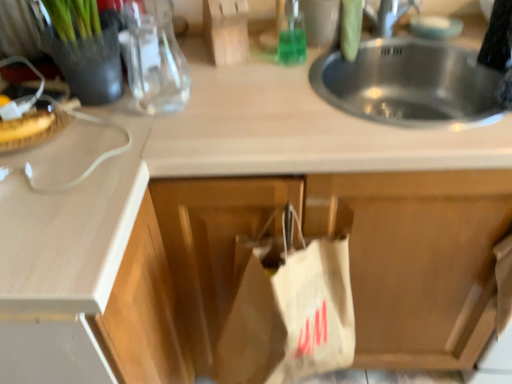
Question: Should I look upward or downward to see green glass bottle at upper center, which appears as the 2th bottle when viewed from the left?

Choices:
 (A) up
 (B) down

Answer: (A)

Question: From a real-world perspective, does white matte cabinet at center stand above green glass bottle at upper center, which is the 2th bottle from front to back?

Choices:
 (A) yes
 (B) no

Answer: (B)

Question: Is white matte cabinet at center positioned beyond the bounds of green glass bottle at upper center, the 1th bottle viewed from the right?

Choices:
 (A) yes
 (B) no

Answer: (A)

Question: From the image's perspective, is white matte cabinet at center over green glass bottle at upper center, the 1th bottle viewed from the right?

Choices:
 (A) no
 (B) yes

Answer: (A)

Question: Does white matte cabinet at center have a larger size compared to green glass bottle at upper center, which appears as the 2th bottle when viewed from the left?

Choices:
 (A) no
 (B) yes

Answer: (B)

Question: Does white matte cabinet at center have a lesser height compared to green glass bottle at upper center, which appears as the 1th bottle when viewed from the back?

Choices:
 (A) no
 (B) yes

Answer: (A)

Question: Considering the relative sizes of white matte cabinet at center and green glass bottle at upper center, which appears as the 1th bottle when viewed from the back, in the image provided, is white matte cabinet at center taller than green glass bottle at upper center, which appears as the 1th bottle when viewed from the back,?

Choices:
 (A) yes
 (B) no

Answer: (A)

Question: Is transparent glass bottle at upper left, which is the second bottle from back to front, positioned with its back to white matte cabinet at center?

Choices:
 (A) yes
 (B) no

Answer: (B)

Question: Can you confirm if transparent glass bottle at upper left, the 1th bottle positioned from the left, is bigger than white matte cabinet at center?

Choices:
 (A) no
 (B) yes

Answer: (A)

Question: Does transparent glass bottle at upper left, which is the second bottle from back to front, appear on the right side of white matte cabinet at center?

Choices:
 (A) no
 (B) yes

Answer: (A)

Question: From the image's perspective, is transparent glass bottle at upper left, the 1th bottle positioned from the left, beneath white matte cabinet at center?

Choices:
 (A) no
 (B) yes

Answer: (A)

Question: From a real-world perspective, is transparent glass bottle at upper left, the 1th bottle positioned from the left, located higher than white matte cabinet at center?

Choices:
 (A) yes
 (B) no

Answer: (A)

Question: Is transparent glass bottle at upper left, arranged as the first bottle when viewed from the front, outside of white matte cabinet at center?

Choices:
 (A) yes
 (B) no

Answer: (A)

Question: Considering the relative sizes of breadtexturedat left and green glass bottle at upper center, which is the 2th bottle from front to back, in the image provided, is breadtexturedat left shorter than green glass bottle at upper center, which is the 2th bottle from front to back,?

Choices:
 (A) yes
 (B) no

Answer: (A)